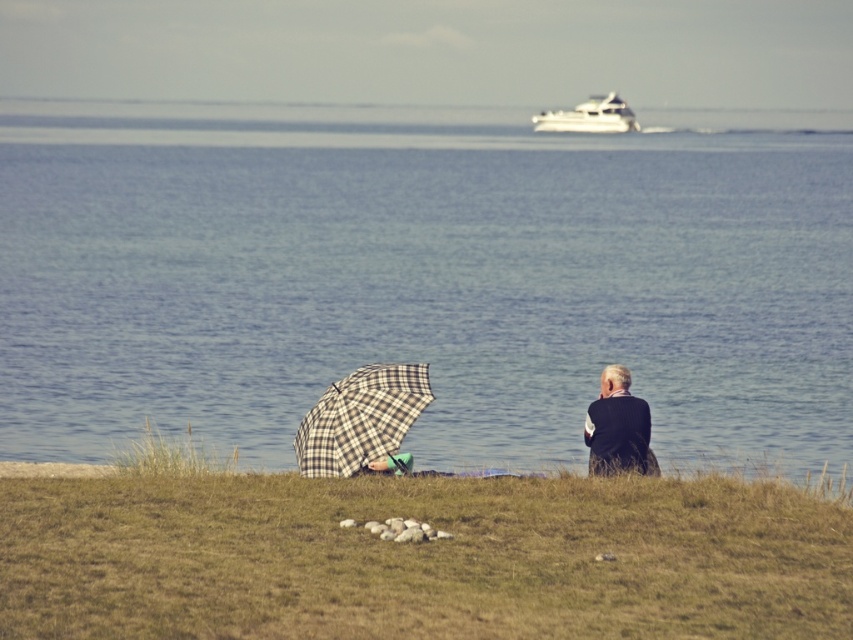
You are a tailor who needs to determine which item is wider between the plaid fabric umbrella at lower left and the dark blue wool sweater at right. Based on the scene, which one has a greater width?

The plaid fabric umbrella at lower left has a greater width than the dark blue wool sweater at right according to the description.

You are standing at the origin point in the coastal scene. There are two points marked in the image. Which point is closer to you, the point at coordinate point (x=358, y=456) or point (x=606, y=467)?

Point (x=358, y=456) is in front of point (x=606, y=467), so it is closer to you.

You are a photographer planning to capture the scene with the dark blue wool sweater at right and the white glossy yacht at upper center. Which object should you focus on first if you want to include both in your shot without zooming in or out?

The dark blue wool sweater at right is smaller than the white glossy yacht at upper center, so you should focus on the white glossy yacht at upper center first to ensure it fits in the frame before adjusting for the smaller sweater.